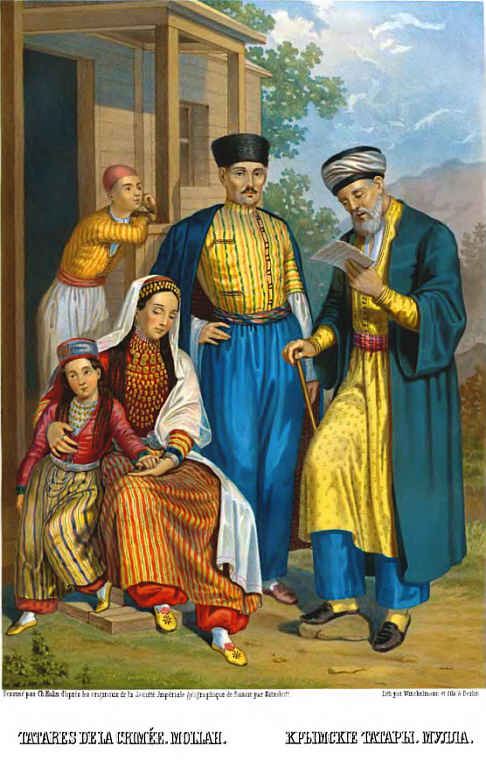
The image size is (486, 760). I want to click on handle, so click(286, 352).